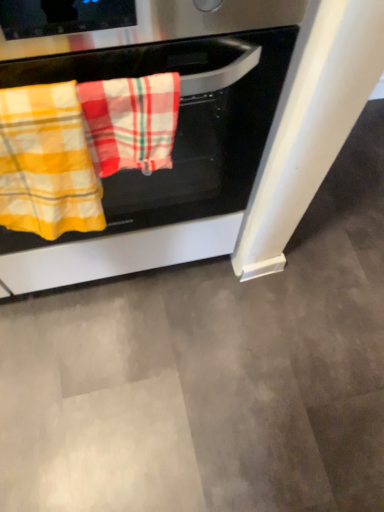
Question: Does plaid cotton beach towel at center, the second beach towel viewed from the left, have a greater height compared to stainless steel oven at center?

Choices:
 (A) no
 (B) yes

Answer: (A)

Question: Considering the relative sizes of plaid cotton beach towel at center, the second beach towel viewed from the left, and stainless steel oven at center in the image provided, is plaid cotton beach towel at center, the second beach towel viewed from the left, smaller than stainless steel oven at center?

Choices:
 (A) no
 (B) yes

Answer: (B)

Question: Is stainless steel oven at center completely or partially inside plaid cotton beach towel at center, the second beach towel viewed from the left?

Choices:
 (A) yes
 (B) no

Answer: (B)

Question: Can you confirm if plaid cotton beach towel at center, the second beach towel viewed from the left, is shorter than stainless steel oven at center?

Choices:
 (A) yes
 (B) no

Answer: (A)

Question: Is plaid cotton beach towel at center, acting as the 1th beach towel starting from the right, aimed at stainless steel oven at center?

Choices:
 (A) no
 (B) yes

Answer: (A)

Question: From a real-world perspective, is plaid cotton beach towel at center, the second beach towel viewed from the left, on top of stainless steel oven at center?

Choices:
 (A) yes
 (B) no

Answer: (A)

Question: Is yellow plaid towel at left, positioned as the 1th beach towel in left-to-right order, in front of stainless steel oven at center?

Choices:
 (A) yes
 (B) no

Answer: (B)

Question: Is yellow plaid towel at left, positioned as the 1th beach towel in left-to-right order, bigger than stainless steel oven at center?

Choices:
 (A) yes
 (B) no

Answer: (B)

Question: Are yellow plaid towel at left, which ranks as the 2th beach towel in right-to-left order, and stainless steel oven at center located far from each other?

Choices:
 (A) no
 (B) yes

Answer: (A)

Question: Does yellow plaid towel at left, positioned as the 1th beach towel in left-to-right order, have a greater width compared to stainless steel oven at center?

Choices:
 (A) yes
 (B) no

Answer: (B)

Question: Considering the relative positions of yellow plaid towel at left, positioned as the 1th beach towel in left-to-right order, and stainless steel oven at center in the image provided, is yellow plaid towel at left, positioned as the 1th beach towel in left-to-right order, to the left of stainless steel oven at center from the viewer's perspective?

Choices:
 (A) yes
 (B) no

Answer: (A)

Question: From a real-world perspective, does yellow plaid towel at left, which ranks as the 2th beach towel in right-to-left order, stand above stainless steel oven at center?

Choices:
 (A) no
 (B) yes

Answer: (B)

Question: Is plaid cotton beach towel at center, acting as the 1th beach towel starting from the right, wider than yellow plaid towel at left, positioned as the 1th beach towel in left-to-right order?

Choices:
 (A) yes
 (B) no

Answer: (B)